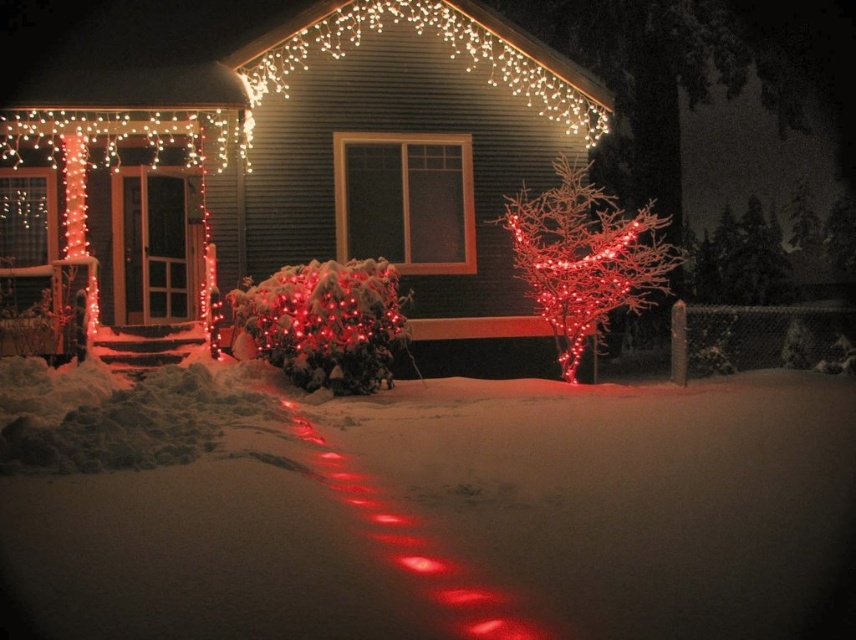
Question: Can you confirm if white powdery snow at lower center is positioned above illuminated wireframe tree at center-right?

Choices:
 (A) no
 (B) yes

Answer: (A)

Question: Is white powdery snow at lower center to the right of illuminated wireframe tree at center-right from the viewer's perspective?

Choices:
 (A) no
 (B) yes

Answer: (A)

Question: Which point appears closest to the camera in this image?

Choices:
 (A) (586, 196)
 (B) (842, 452)

Answer: (B)

Question: Which object appears closest to the camera in this image?

Choices:
 (A) illuminated wireframe tree at center-right
 (B) white powdery snow at lower center

Answer: (B)

Question: Does white powdery snow at lower center have a smaller size compared to illuminated wireframe tree at center-right?

Choices:
 (A) no
 (B) yes

Answer: (A)

Question: Which object appears farthest from the camera in this image?

Choices:
 (A) white powdery snow at lower center
 (B) illuminated wireframe tree at center-right

Answer: (B)